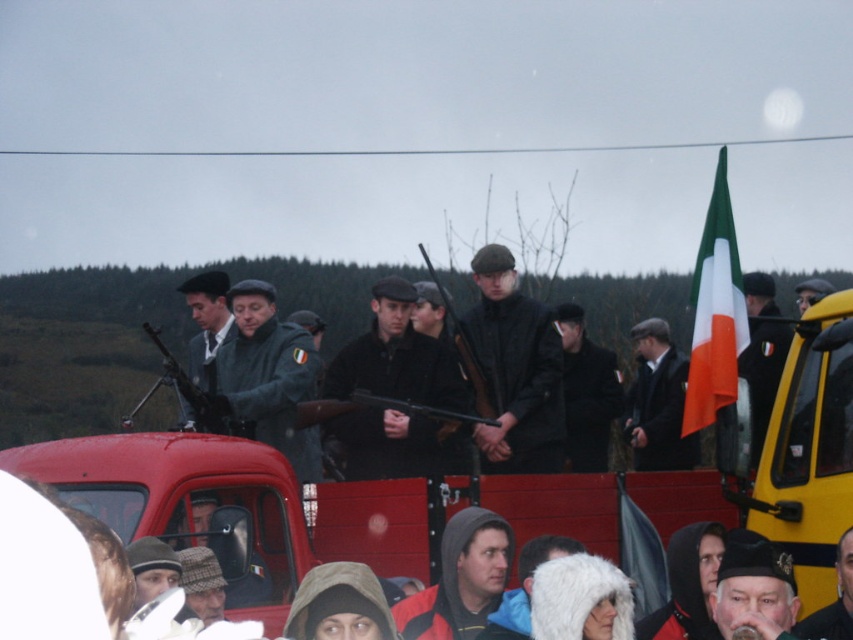
Question: Which of the following is the closest to the observer?

Choices:
 (A) (212, 289)
 (B) (386, 340)
 (C) (495, 449)

Answer: (C)

Question: Can you confirm if matte green jacket at center is wider than smooth leather jacket at center?

Choices:
 (A) yes
 (B) no

Answer: (A)

Question: Which of the following is the closest to the observer?

Choices:
 (A) matte black suit at center
 (B) dark matte coat at center
 (C) matte black jacket at center

Answer: (A)

Question: Can you confirm if dark gray wool coat at center is positioned to the right of matte black suit at center?

Choices:
 (A) no
 (B) yes

Answer: (B)

Question: Is black matte jacket at center to the left of dark gray wool coat at center from the viewer's perspective?

Choices:
 (A) no
 (B) yes

Answer: (B)

Question: Which point is farther to the camera?

Choices:
 (A) dark gray wool coat at center
 (B) dark gray wool cap at center
 (C) red hooded jacket at center
 (D) matte black suit at center

Answer: (A)